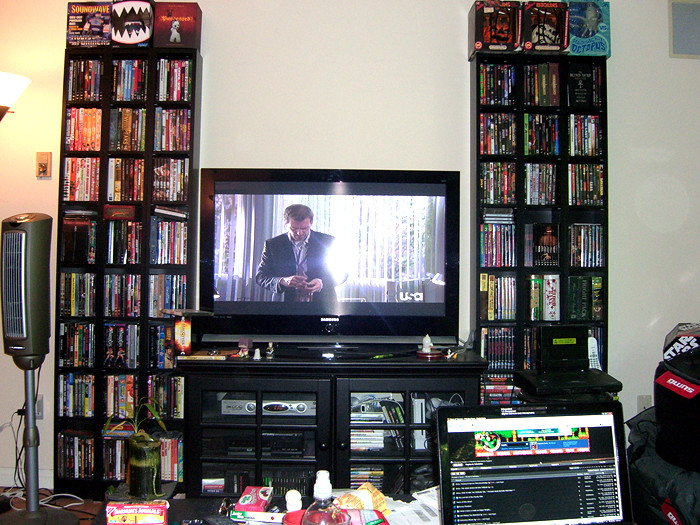
Locate an element on the screen. lamp is located at coordinates (8, 75).